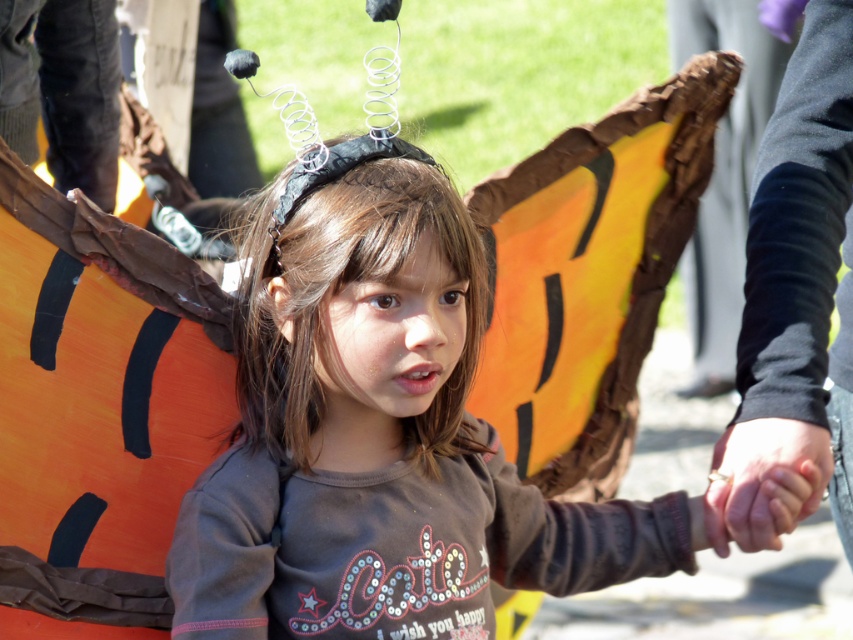
You are a costume designer observing the child in the scene. You need to ensure that the pumpkin prop is visible from a distance. Considering the matte brown shirt at center and the smooth skin hand at center, which object should be placed higher to make the pumpkin prop more prominent?

The matte brown shirt at center is taller than the smooth skin hand at center. To make the pumpkin prop more prominent, the matte brown shirt at center should be placed higher since it is already taller and can draw attention upwards toward the pumpkin prop.

You are a costume designer preparing for a Halloween event. You need to place a pumpkin prop behind the child in the image. The pumpkin prop must be positioned so that it does not overlap with the matte brown shirt at center. Given that the pumpkin prop will occupy a space at coordinates point (x=386, y=449), is this placement feasible?

The point (x=386, y=449) indicates the location of the matte brown shirt at center. Placing the pumpkin prop at this coordinate would directly overlap with the matte brown shirt at center, making it infeasible.

You are a costume designer observing the child in the image. You need to ensure the costume is safe for movement. Since the matte brown shirt at center and smooth skin hand at center are part of the costume, which one is positioned higher on the child?

The matte brown shirt at center is above the smooth skin hand at center, so the shirt is positioned higher on the child.